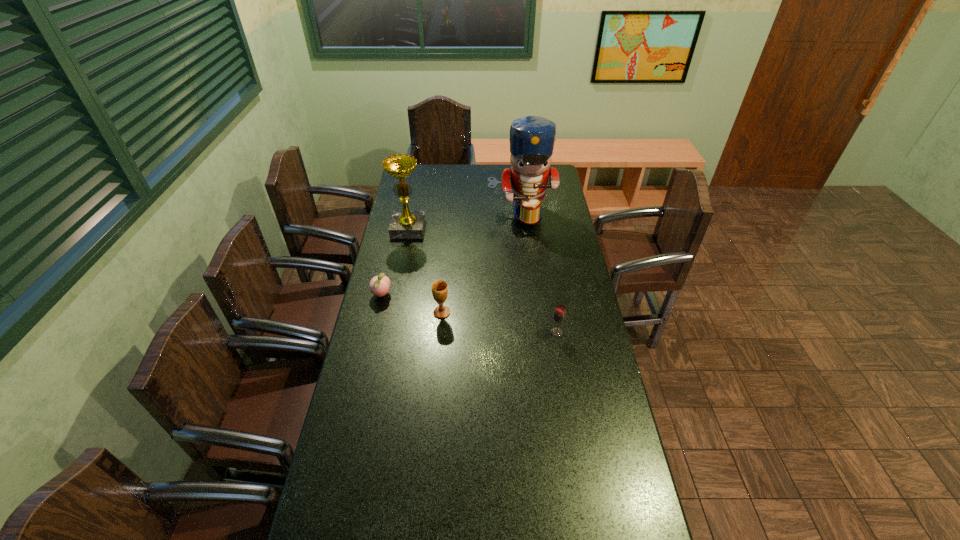
Locate an element on the screen. the tallest object is located at coordinates (532, 138).

This screenshot has width=960, height=540. I want to click on the fourth shortest object, so click(405, 224).

Locate an element on the screen. The width and height of the screenshot is (960, 540). the fourth farthest object is located at coordinates (439, 288).

The height and width of the screenshot is (540, 960). I want to click on the third object from right to left, so click(439, 288).

Where is `the nearest object`? Image resolution: width=960 pixels, height=540 pixels. the nearest object is located at coordinates [559, 315].

Locate an element on the screen. The height and width of the screenshot is (540, 960). peach is located at coordinates (379, 285).

I want to click on the third farthest object, so click(x=379, y=285).

This screenshot has height=540, width=960. Find the location of `blank space located on the front-facing side of the tallest object`. blank space located on the front-facing side of the tallest object is located at coordinates (525, 249).

The width and height of the screenshot is (960, 540). Identify the location of free space located 0.140m on the front-facing side of the second tallest object. (402, 259).

Find the location of a particular element. vacant space located 0.190m on the back of the chalice is located at coordinates (445, 273).